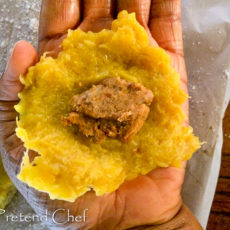
Locate an element on the screen. table is located at coordinates (220, 188).